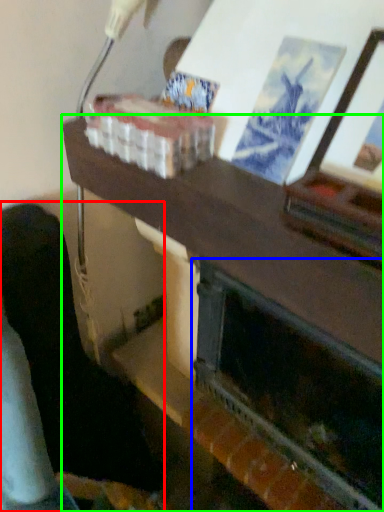
Question: Estimate the real-world distances between objects in this image. Which object is farther from furniture (highlighted by a red box), fireplace (highlighted by a blue box) or table (highlighted by a green box)?

Choices:
 (A) fireplace
 (B) table

Answer: (A)